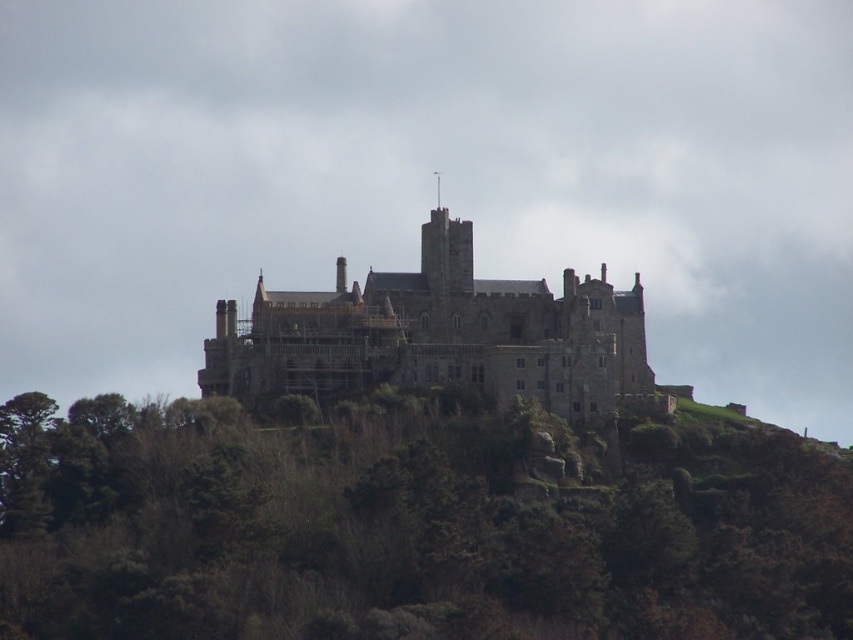
Question: Which point is closer to the camera?

Choices:
 (A) stone castle at center
 (B) green leafy tree at center

Answer: (B)

Question: Does green leafy tree at center have a smaller size compared to stone castle at center?

Choices:
 (A) yes
 (B) no

Answer: (B)

Question: Which of the following is the closest to the observer?

Choices:
 (A) (676, 611)
 (B) (506, 348)

Answer: (A)

Question: From the image, what is the correct spatial relationship of green leafy tree at center in relation to stone castle at center?

Choices:
 (A) below
 (B) above

Answer: (A)

Question: Where is green leafy tree at center located in relation to stone castle at center in the image?

Choices:
 (A) left
 (B) right

Answer: (B)